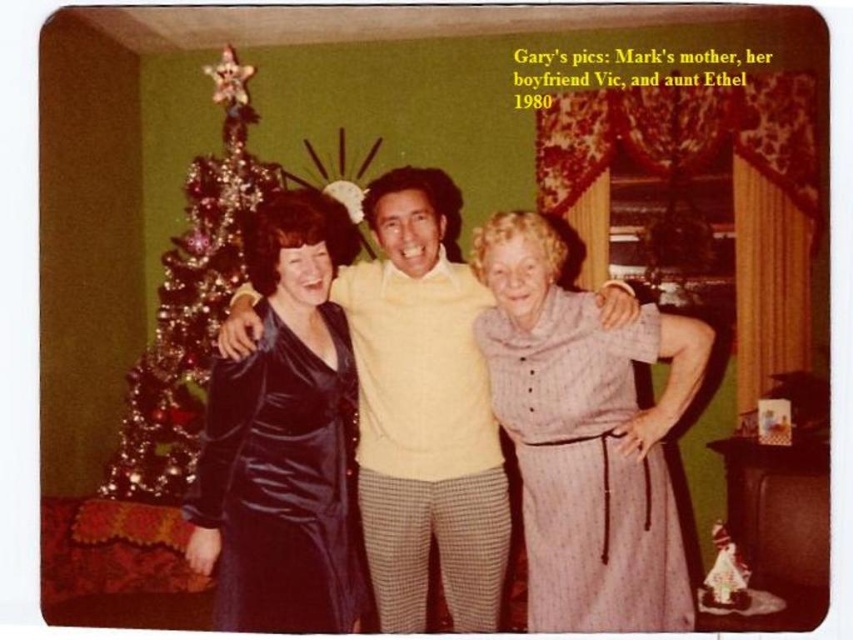
Does shiny purple dress at center have a lesser height compared to shiny metallic tree at left?

Indeed, shiny purple dress at center has a lesser height compared to shiny metallic tree at left.

Describe the element at coordinates (283, 444) in the screenshot. The image size is (853, 640). I see `shiny purple dress at center` at that location.

You are a GUI agent. You are given a task and a screenshot of the screen. Output one action in this format:
    pyautogui.click(x=<x>, y=<y>)
    Task: Click on the shiny purple dress at center
    The height and width of the screenshot is (640, 853).
    Given the screenshot: What is the action you would take?
    pyautogui.click(x=283, y=444)

Which is more to the left, striped fabric dress at center or satin dress at center?

satin dress at center

Between striped fabric dress at center and satin dress at center, which one is positioned higher?

Positioned higher is satin dress at center.

Between point (543, 561) and point (466, 282), which one is positioned behind?

The point (466, 282) is behind.

I want to click on striped fabric dress at center, so click(585, 436).

In the scene shown: Who is positioned more to the left, satin dress at center or shiny purple dress at center?

From the viewer's perspective, shiny purple dress at center appears more on the left side.

Image resolution: width=853 pixels, height=640 pixels. Identify the location of satin dress at center. [x=422, y=413].